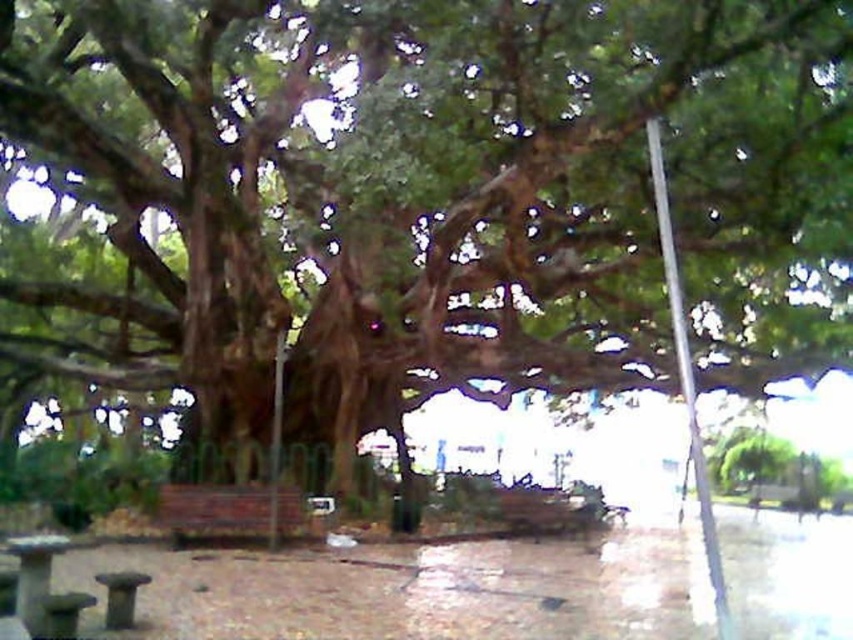
You are standing at the point marked by the coordinates point (229, 509) in the image. What object are you standing on?

The point (229, 509) indicates a brown wooden bench at lower center, so you are standing on the brown wooden bench at lower center.

Looking at this image, you are a visitor in the park and want to sit on the closest bench to you. Which bench should you choose between the brown wooden bench at lower center and the wooden park bench at lower left?

You should choose the brown wooden bench at lower center because it is closer to you than the wooden park bench at lower left.

You are planning to have a picnic and need to choose between the wooden picnic table at lower left and the wooden park bench at lower left. Which one is more accessible to sit on immediately?

The wooden picnic table at lower left is closer to the viewer than the wooden park bench at lower left, so it is more accessible to sit on immediately.